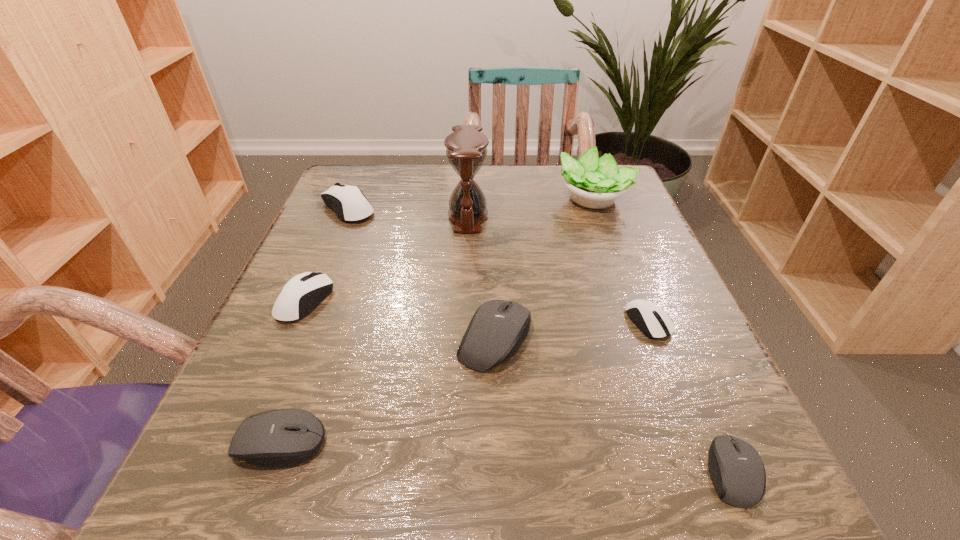
Locate an element on the screen. Image resolution: width=960 pixels, height=540 pixels. hourglass is located at coordinates (466, 148).

The height and width of the screenshot is (540, 960). What are the coordinates of `the tallest object` in the screenshot? It's located at (466, 148).

Locate an element on the screen. This screenshot has width=960, height=540. green lettuce is located at coordinates (593, 182).

At what (x,y) coordinates should I click in order to perform the action: click on the second tallest object. Please return your answer as a coordinate pair (x, y). The width and height of the screenshot is (960, 540). Looking at the image, I should click on (593, 182).

This screenshot has width=960, height=540. Identify the location of the farthest white mouse. (348, 202).

Find the location of a particular element. The width and height of the screenshot is (960, 540). the biggest white mouse is located at coordinates (348, 202).

Image resolution: width=960 pixels, height=540 pixels. Identify the location of the farthest black computer equipment. (498, 328).

This screenshot has height=540, width=960. Find the location of `the second black computer equipment from left to right`. the second black computer equipment from left to right is located at coordinates (498, 328).

The width and height of the screenshot is (960, 540). I want to click on the second smallest white mouse, so click(x=302, y=293).

What are the coordinates of `the leftmost black computer equipment` in the screenshot? It's located at (284, 437).